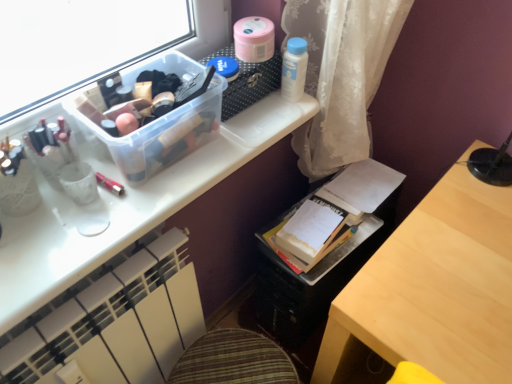
The image size is (512, 384). What are the coordinates of `free space to the left of metallic pink pen at upper left, the second toiletry from the right` in the screenshot? It's located at (48, 206).